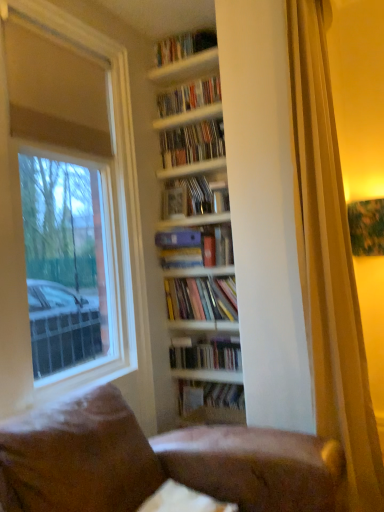
Question: Based on their sizes in the image, would you say brown leather couch at lower center is bigger or smaller than hardcover book at center, arranged as the 8th book when viewed from the top?

Choices:
 (A) small
 (B) big

Answer: (A)

Question: Is brown leather couch at lower center in front of or behind hardcover book at center, which is the 1th book in bottom-to-top order, in the image?

Choices:
 (A) front
 (B) behind

Answer: (A)

Question: Estimate the real-world distances between objects in this image. Which object is farther from the wooden shelves at upper center, the 1th shelf ordered from the bottom?

Choices:
 (A) hardcover books at center, the 6th book positioned from the top
 (B) matte plastic books at upper center, placed as the 6th book when sorted from bottom to top
 (C) hardcover books at upper center, which is the first book in top-to-bottom order
 (D) hardcover book at center, which is the 1th book in bottom-to-top order
 (E) white matte window at left

Answer: (D)

Question: Which object is the closest to the matte blue folder at center, which appears as the fourth book when ordered from the bottom?

Choices:
 (A) wooden shelves at upper center, which is the 2th shelf in top-to-bottom order
 (B) hardcover book at center
 (C) hardcover book at center, which is the 1th book in bottom-to-top order
 (D) hardcover books at upper center, the eighth book from the bottom
 (E) brown leather couch at lower center

Answer: (B)